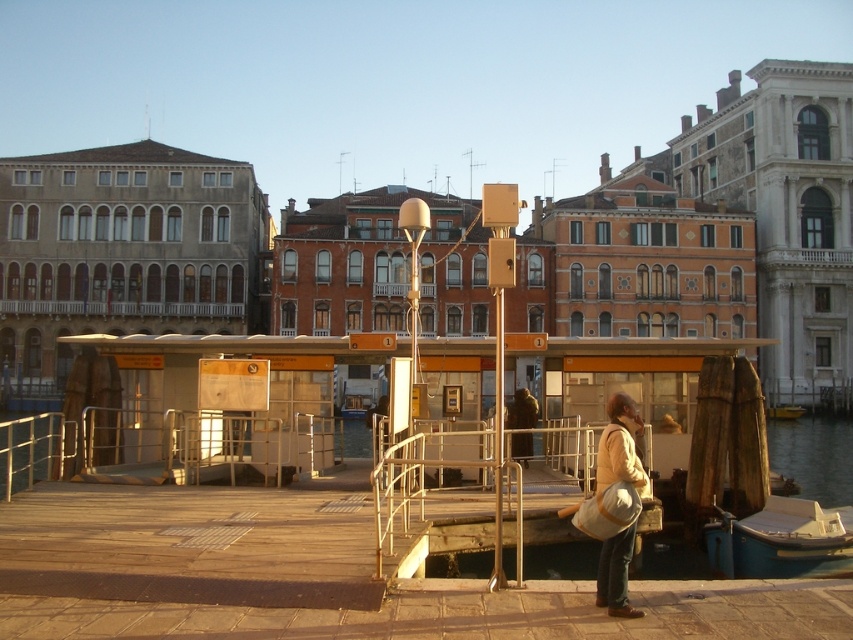
Is blue plastic boat at lower right thinner than light brown fabric bag at lower right?

No.

Does point (746, 532) lie in front of point (624, 445)?

No, it is not.

Find the location of `blue plastic boat at lower right`. blue plastic boat at lower right is located at coordinates (781, 540).

Between light brown fabric bag at lower right and yellow matte boat at lower right, which one has less height?

yellow matte boat at lower right is shorter.

Does point (636, 419) come in front of point (793, 410)?

Yes, it is in front of point (793, 410).

Between point (601, 596) and point (795, 413), which one is positioned in front?

Point (601, 596) is more forward.

The width and height of the screenshot is (853, 640). Identify the location of light brown fabric bag at lower right. (619, 444).

Can you confirm if blue plastic boat at lower right is thinner than yellow matte boat at lower right?

Incorrect, blue plastic boat at lower right's width is not less than yellow matte boat at lower right's.

Can you confirm if blue plastic boat at lower right is positioned above yellow matte boat at lower right?

No.

This screenshot has height=640, width=853. I want to click on blue plastic boat at lower right, so click(x=781, y=540).